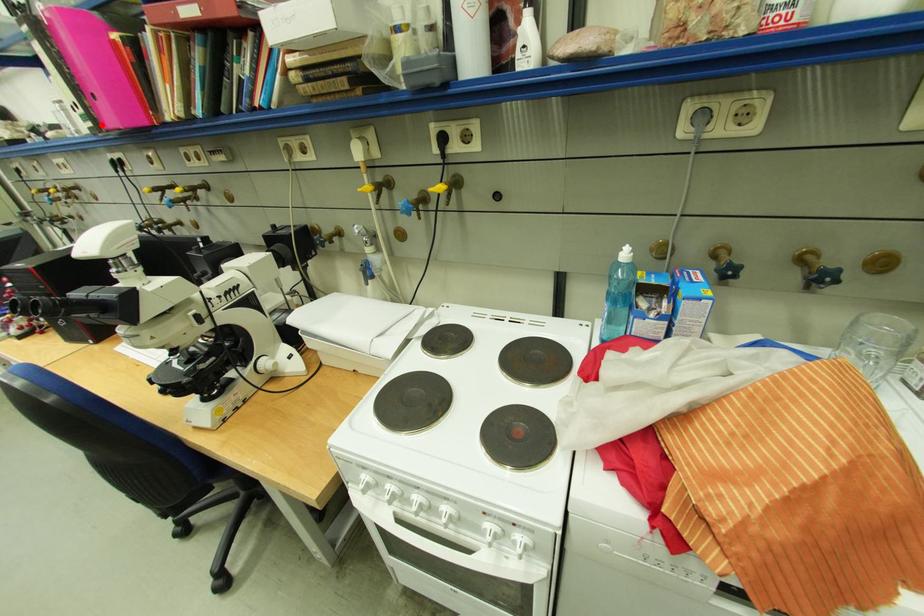
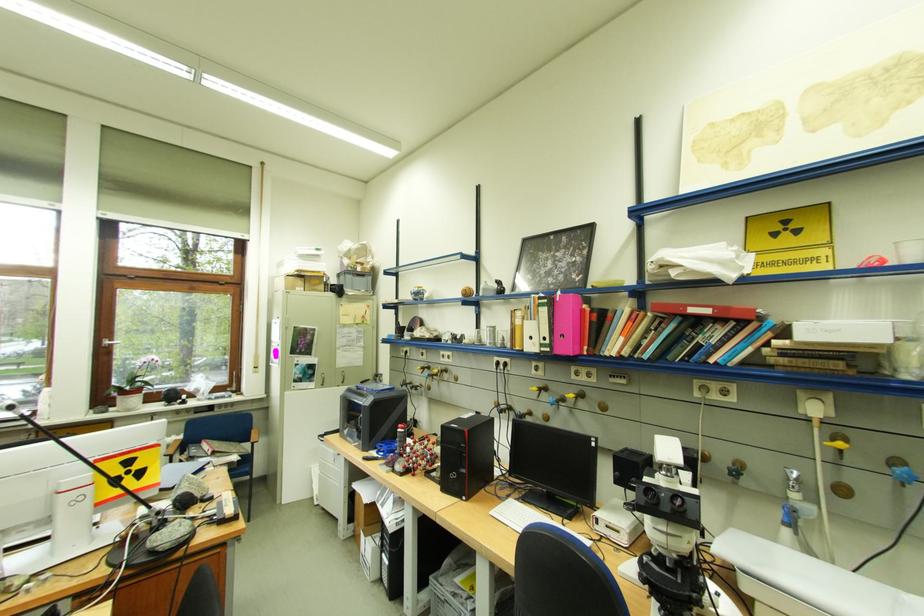
Find the pixel in the second image that matches the highlighted location in the first image.

(558, 351)